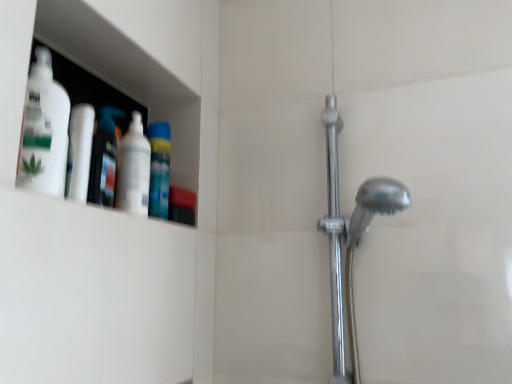
The width and height of the screenshot is (512, 384). I want to click on white matte bottle at upper left, the first cleaning product from the front, so click(44, 130).

Locate an element on the screen. Image resolution: width=512 pixels, height=384 pixels. white glossy bottle at upper left, marked as the third cleaning product in a front-to-back arrangement is located at coordinates (133, 169).

Where is `polished chrome shower door at right`? This screenshot has width=512, height=384. polished chrome shower door at right is located at coordinates (335, 238).

Locate an element on the screen. translucent plastic bottle at left, acting as the second cleaning product starting from the back is located at coordinates (104, 158).

This screenshot has height=384, width=512. I want to click on white matte bottle at upper left, the 3th cleaning product when ordered from back to front, so click(x=44, y=130).

From the translucent plastic bottle at left, the 2th cleaning product from the front, count 1st mouthwash to the right and point to it. Please provide its 2D coordinates.

[(80, 152)]

Looking at this image, would you say white glossy bottle at left, marked as the 1th mouthwash in a front-to-back arrangement, is outside translucent plastic bottle at left, the 2th cleaning product from the front?

Yes, white glossy bottle at left, marked as the 1th mouthwash in a front-to-back arrangement, is not within translucent plastic bottle at left, the 2th cleaning product from the front.

Is white glossy bottle at left, marked as the 2th mouthwash in a right-to-left arrangement, far from translucent plastic bottle at left, acting as the second cleaning product starting from the back?

That's not correct — white glossy bottle at left, marked as the 2th mouthwash in a right-to-left arrangement, is a little close to translucent plastic bottle at left, acting as the second cleaning product starting from the back.

From a real-world perspective, who is located lower, white glossy bottle at left, marked as the 2th mouthwash in a right-to-left arrangement, or translucent plastic bottle at left, acting as the second cleaning product starting from the back?

From a 3D spatial view, white glossy bottle at left, marked as the 2th mouthwash in a right-to-left arrangement, is below.

Considering the relative sizes of white glossy bottle at upper left, marked as the third cleaning product in a front-to-back arrangement, and translucent plastic bottle at left, acting as the second cleaning product starting from the back, in the image provided, is white glossy bottle at upper left, marked as the third cleaning product in a front-to-back arrangement, bigger than translucent plastic bottle at left, acting as the second cleaning product starting from the back,?

Indeed, white glossy bottle at upper left, marked as the third cleaning product in a front-to-back arrangement, has a larger size compared to translucent plastic bottle at left, acting as the second cleaning product starting from the back.

Could you measure the distance between white glossy bottle at upper left, arranged as the 1th cleaning product when viewed from the back, and translucent plastic bottle at left, the 2th cleaning product from the front?

white glossy bottle at upper left, arranged as the 1th cleaning product when viewed from the back, is 1.83 inches from translucent plastic bottle at left, the 2th cleaning product from the front.

From the image's perspective, is white glossy bottle at upper left, arranged as the 1th cleaning product when viewed from the back, above translucent plastic bottle at left, acting as the second cleaning product starting from the back?

Yes, from the image's perspective, white glossy bottle at upper left, arranged as the 1th cleaning product when viewed from the back, is above translucent plastic bottle at left, acting as the second cleaning product starting from the back.

From a real-world perspective, which is physically below, white glossy bottle at upper left, arranged as the 1th cleaning product when viewed from the back, or translucent plastic bottle at left, acting as the second cleaning product starting from the back?

In real-world perspective, translucent plastic bottle at left, acting as the second cleaning product starting from the back, is lower.

From the picture: How different are the orientations of blue matte mouthwash at upper left, the first mouthwash from the back, and white matte bottle at upper left, the first cleaning product from the front, in degrees?

The angular difference between blue matte mouthwash at upper left, the first mouthwash from the back, and white matte bottle at upper left, the first cleaning product from the front, is 0.859 degrees.

Starting from the blue matte mouthwash at upper left, acting as the 1th mouthwash starting from the right, which cleaning product is the 3rd one in front? Please provide its 2D coordinates.

[(44, 130)]

Between blue matte mouthwash at upper left, the first mouthwash from the back, and white matte bottle at upper left, the 3th cleaning product when ordered from back to front, which one has larger width?

With larger width is white matte bottle at upper left, the 3th cleaning product when ordered from back to front.

Is blue matte mouthwash at upper left, placed as the 2th mouthwash when sorted from front to back, taller or shorter than white matte bottle at upper left, the first cleaning product from the front?

blue matte mouthwash at upper left, placed as the 2th mouthwash when sorted from front to back, is shorter than white matte bottle at upper left, the first cleaning product from the front.

Considering the positions of objects translucent plastic bottle at left, acting as the second cleaning product starting from the back, and white matte bottle at upper left, the 3th cleaning product when ordered from back to front, in the image provided, who is in front, translucent plastic bottle at left, acting as the second cleaning product starting from the back, or white matte bottle at upper left, the 3th cleaning product when ordered from back to front,?

white matte bottle at upper left, the 3th cleaning product when ordered from back to front.

Can you confirm if translucent plastic bottle at left, the 2th cleaning product from the front, is positioned to the left of white matte bottle at upper left, the 3th cleaning product when ordered from back to front?

No, translucent plastic bottle at left, the 2th cleaning product from the front, is not to the left of white matte bottle at upper left, the 3th cleaning product when ordered from back to front.

Measure the distance from translucent plastic bottle at left, the 2th cleaning product from the front, to white matte bottle at upper left, the 3th cleaning product when ordered from back to front.

translucent plastic bottle at left, the 2th cleaning product from the front, and white matte bottle at upper left, the 3th cleaning product when ordered from back to front, are 4.09 inches apart.

Is translucent plastic bottle at left, acting as the second cleaning product starting from the back, facing towards white matte bottle at upper left, the first cleaning product from the front?

No, translucent plastic bottle at left, acting as the second cleaning product starting from the back, is not turned towards white matte bottle at upper left, the first cleaning product from the front.

Is polished chrome shower door at right oriented away from translucent plastic bottle at left, the 2th cleaning product from the front?

No, translucent plastic bottle at left, the 2th cleaning product from the front, is not at the back of polished chrome shower door at right.

From a real-world perspective, is polished chrome shower door at right above or below translucent plastic bottle at left, acting as the second cleaning product starting from the back?

polished chrome shower door at right is situated lower than translucent plastic bottle at left, acting as the second cleaning product starting from the back, in the real world.

How many degrees apart are the facing directions of polished chrome shower door at right and translucent plastic bottle at left, acting as the second cleaning product starting from the back?

There is a 94.2-degree angle between the facing directions of polished chrome shower door at right and translucent plastic bottle at left, acting as the second cleaning product starting from the back.

Locate an element on the screen. This screenshot has height=384, width=512. shower door lying on the right of translucent plastic bottle at left, the 2th cleaning product from the front is located at coordinates (335, 238).

Are white glossy bottle at upper left, marked as the third cleaning product in a front-to-back arrangement, and white matte bottle at upper left, the first cleaning product from the front, beside each other?

No, white glossy bottle at upper left, marked as the third cleaning product in a front-to-back arrangement, is not next to white matte bottle at upper left, the first cleaning product from the front.

Is the depth of white glossy bottle at upper left, marked as the third cleaning product in a front-to-back arrangement, less than that of white matte bottle at upper left, the first cleaning product from the front?

No, white glossy bottle at upper left, marked as the third cleaning product in a front-to-back arrangement, is further to the viewer.

From the image's perspective, who appears lower, white glossy bottle at upper left, arranged as the 1th cleaning product when viewed from the back, or white matte bottle at upper left, the first cleaning product from the front?

white glossy bottle at upper left, arranged as the 1th cleaning product when viewed from the back, from the image's perspective.

Which is nearer, (142,205) or (338,204)?

Positioned in front is point (142,205).

At what (x,y) coordinates should I click in order to perform the action: click on the 1st cleaning product in front of the polished chrome shower door at right, counting from the anchor's position. Please return your answer as a coordinate pair (x, y). This screenshot has width=512, height=384. Looking at the image, I should click on (133, 169).

How many degrees apart are the facing directions of white glossy bottle at upper left, marked as the third cleaning product in a front-to-back arrangement, and polished chrome shower door at right?

90.1 degrees separate the facing orientations of white glossy bottle at upper left, marked as the third cleaning product in a front-to-back arrangement, and polished chrome shower door at right.

Can you confirm if white glossy bottle at upper left, arranged as the 1th cleaning product when viewed from the back, is shorter than polished chrome shower door at right?

Yes.

Where is `cleaning product that is the 2nd one when counting downward from the white glossy bottle at left, acting as the 2th mouthwash starting from the back (from the image's perspective)`? Image resolution: width=512 pixels, height=384 pixels. cleaning product that is the 2nd one when counting downward from the white glossy bottle at left, acting as the 2th mouthwash starting from the back (from the image's perspective) is located at coordinates (104, 158).

Identify the location of cleaning product on the right of translucent plastic bottle at left, the 2th cleaning product from the front. Image resolution: width=512 pixels, height=384 pixels. (133, 169).

From the picture: Based on their spatial positions, is translucent plastic bottle at left, the 2th cleaning product from the front, or polished chrome shower door at right closer to white matte bottle at upper left, the first cleaning product from the front?

translucent plastic bottle at left, the 2th cleaning product from the front, lies closer to white matte bottle at upper left, the first cleaning product from the front, than the other object.

When comparing their distances from blue matte mouthwash at upper left, the second mouthwash positioned from the left, does white matte bottle at upper left, the 3th cleaning product when ordered from back to front, or translucent plastic bottle at left, acting as the second cleaning product starting from the back, seem closer?

translucent plastic bottle at left, acting as the second cleaning product starting from the back.

From the image, which object appears to be farther from polished chrome shower door at right, white glossy bottle at left, marked as the 1th mouthwash in a front-to-back arrangement, or white matte bottle at upper left, the first cleaning product from the front?

white matte bottle at upper left, the first cleaning product from the front, is positioned further to the anchor polished chrome shower door at right.

From the image, which object appears to be farther from blue matte mouthwash at upper left, the first mouthwash from the back, white glossy bottle at left, which ranks as the 1th mouthwash in left-to-right order, or white glossy bottle at upper left, marked as the third cleaning product in a front-to-back arrangement?

Among the two, white glossy bottle at left, which ranks as the 1th mouthwash in left-to-right order, is located further to blue matte mouthwash at upper left, the first mouthwash from the back.

Estimate the real-world distances between objects in this image. Which object is further from polished chrome shower door at right, white glossy bottle at left, marked as the 2th mouthwash in a right-to-left arrangement, or white glossy bottle at upper left, arranged as the 1th cleaning product when viewed from the back?

white glossy bottle at left, marked as the 2th mouthwash in a right-to-left arrangement, is positioned further to the anchor polished chrome shower door at right.

Which object lies nearer to the anchor point polished chrome shower door at right, blue matte mouthwash at upper left, acting as the 1th mouthwash starting from the right, or white matte bottle at upper left, the 3th cleaning product when ordered from back to front?

Based on the image, blue matte mouthwash at upper left, acting as the 1th mouthwash starting from the right, appears to be nearer to polished chrome shower door at right.

From the image, which object appears to be farther from blue matte mouthwash at upper left, acting as the 1th mouthwash starting from the right, translucent plastic bottle at left, acting as the second cleaning product starting from the back, or polished chrome shower door at right?

The object further to blue matte mouthwash at upper left, acting as the 1th mouthwash starting from the right, is polished chrome shower door at right.

When comparing their distances from white glossy bottle at upper left, marked as the third cleaning product in a front-to-back arrangement, does blue matte mouthwash at upper left, the second mouthwash positioned from the left, or polished chrome shower door at right seem closer?

Among the two, blue matte mouthwash at upper left, the second mouthwash positioned from the left, is located nearer to white glossy bottle at upper left, marked as the third cleaning product in a front-to-back arrangement.

Find the location of a particular element. The height and width of the screenshot is (384, 512). mouthwash between white matte bottle at upper left, the first cleaning product from the front, and blue matte mouthwash at upper left, placed as the 2th mouthwash when sorted from front to back, in the front-back direction is located at coordinates (80, 152).

Find the location of a particular element. The height and width of the screenshot is (384, 512). mouthwash between white glossy bottle at left, acting as the 2th mouthwash starting from the back, and polished chrome shower door at right from left to right is located at coordinates (159, 169).

In order to click on cleaning product located between translucent plastic bottle at left, acting as the second cleaning product starting from the back, and blue matte mouthwash at upper left, the first mouthwash from the back, in the left-right direction in this screenshot , I will do click(x=133, y=169).

Locate an element on the screen. The width and height of the screenshot is (512, 384). cleaning product between white glossy bottle at left, which ranks as the 1th mouthwash in left-to-right order, and polished chrome shower door at right is located at coordinates (133, 169).